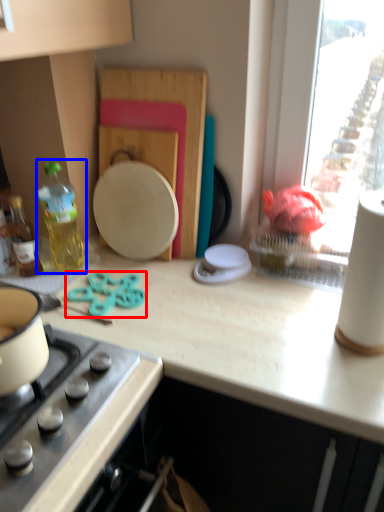
Question: Which object is further to the camera taking this photo, scissors (highlighted by a red box) or bottle (highlighted by a blue box)?

Choices:
 (A) scissors
 (B) bottle

Answer: (B)